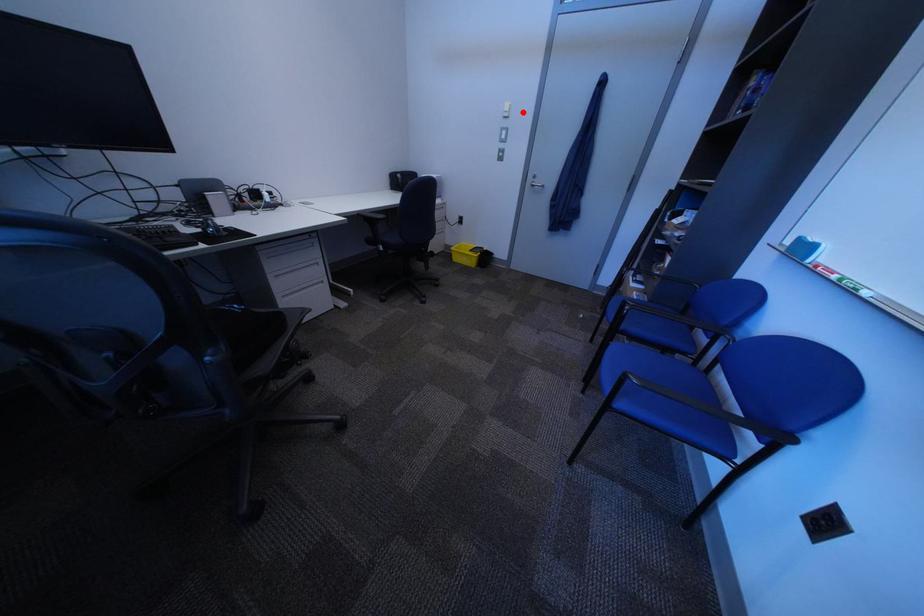
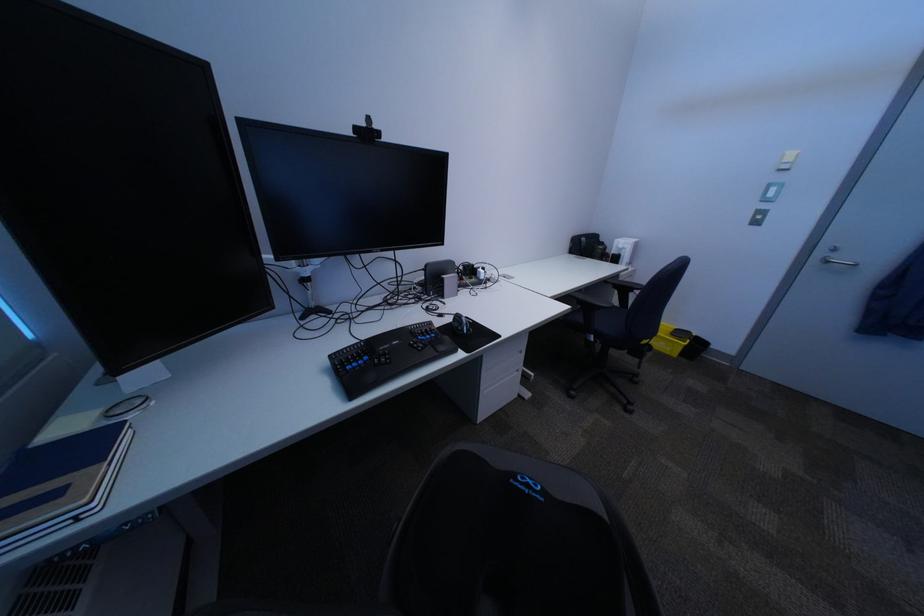
Question: I am providing you with two images of the same scene from different viewpoints. Image1 has a red point marked. In image2, the corresponding 3D location appears at what relative position? Reply with the corresponding letter.

Choices:
 (A) Closer
 (B) Farther

Answer: (B)